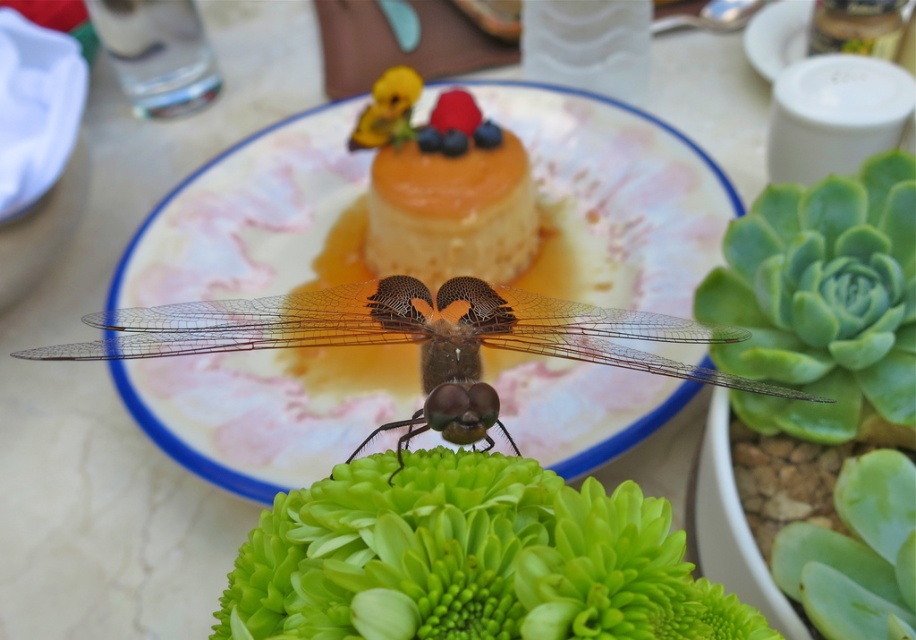
You are a photographer trying to capture both the translucent brown dragonfly at center and the golden caramel flan at center in a single shot. Based on their sizes, which object should you focus on first to ensure both are in clear focus?

The translucent brown dragonfly at center has a lesser height compared to the golden caramel flan at center, so you should focus on the golden caramel flan at center first since it is larger and may require more precise focusing to ensure clarity.

You are a photographer trying to capture the golden caramel flan at center without the green matte flower at center blocking the view. Can you adjust your position to achieve this?

The green matte flower at center is closer to the viewer than golden caramel flan at center, so moving your position to either side might allow you to see around the green matte flower at center and capture the golden caramel flan at center directly.